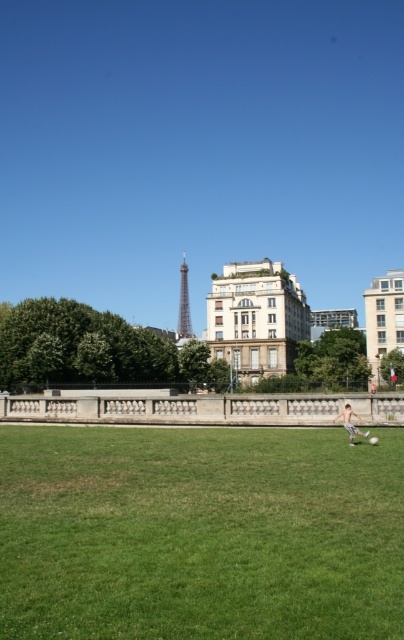
Question: Is white concrete building at right above metallic silver tower at center?

Choices:
 (A) no
 (B) yes

Answer: (B)

Question: Is white concrete building at right to the left of skinny white boy at lower right from the viewer's perspective?

Choices:
 (A) yes
 (B) no

Answer: (B)

Question: Which object is farther from the camera taking this photo?

Choices:
 (A) metallic silver tower at center
 (B) white concrete building at right

Answer: (A)

Question: Which object is the closest to the green grass at lower center?

Choices:
 (A) skinny white boy at lower right
 (B) metallic silver tower at center
 (C) white concrete building at right

Answer: (A)

Question: Can you confirm if green grass at lower center is bigger than metallic silver tower at center?

Choices:
 (A) yes
 (B) no

Answer: (B)

Question: Which point is closer to the camera taking this photo?

Choices:
 (A) (140, 476)
 (B) (387, 307)

Answer: (A)